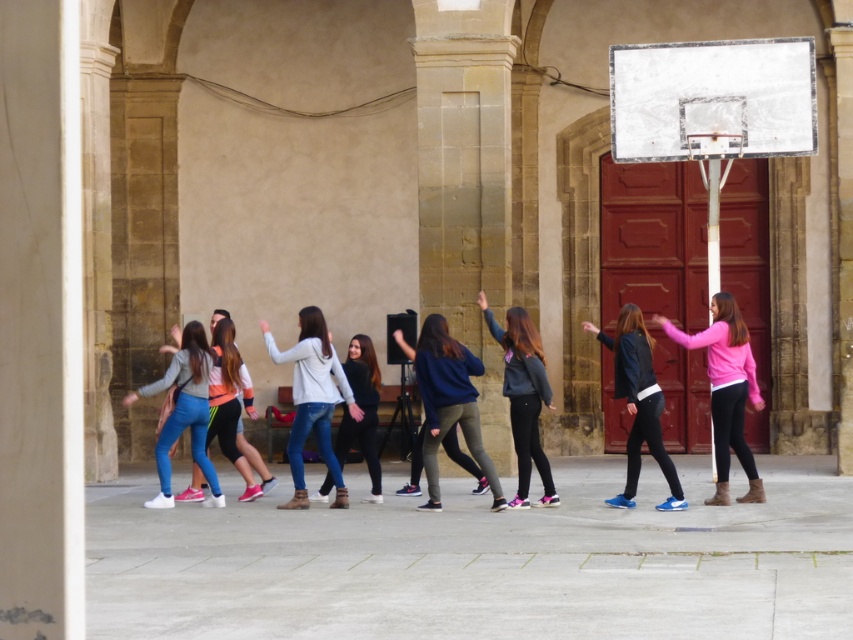
You are a photographer trying to capture a photo of the matte black jacket at center and the blue denim jeans at left. Which object should you focus on first if you want to ensure both are in the frame without moving the camera?

The matte black jacket at center is much taller than the blue denim jeans at left, so you should focus on the matte black jacket at center first to ensure it fits within the frame, then adjust slightly to include the blue denim jeans at left.

You are a photographer positioned at the center of the scene. You want to capture a photo that includes both the matte gray hoodie at center and the blue denim jeans at left. What is the minimum distance you need to move backward to ensure both are in frame?

The matte gray hoodie at center is 3.69 meters from the blue denim jeans at left. To include both in the photo, you need to move backward at least 3.69 meters to ensure both are within the frame.

You are standing in the outdoor area under the stone arches where the group is dancing. You want to move from your current position to the point labeled point [605,500] and then to point [158,451]. Which point will require you to walk further away from the stone arches?

Point [158,451] is further away from the stone arches compared to point [605,500] because point [605,500] is closer to the viewer, implying it is nearer to the arches, while point [158,451] is farther back.